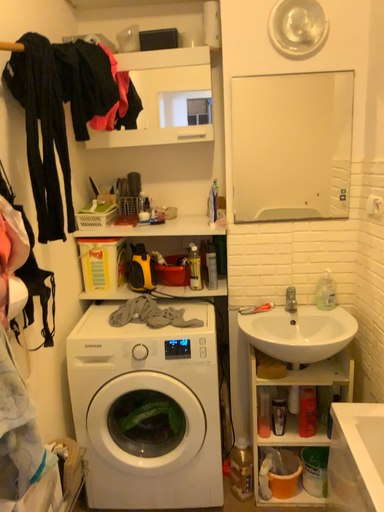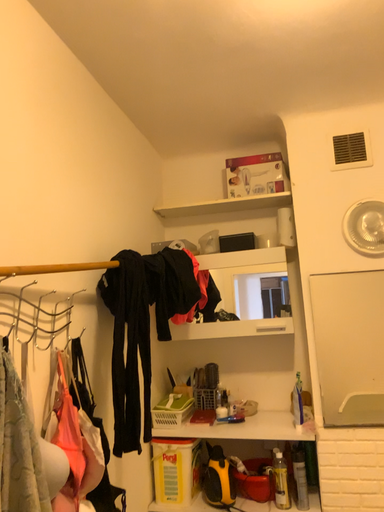
Question: Which way did the camera rotate in the video?

Choices:
 (A) rotated right
 (B) rotated left

Answer: (B)